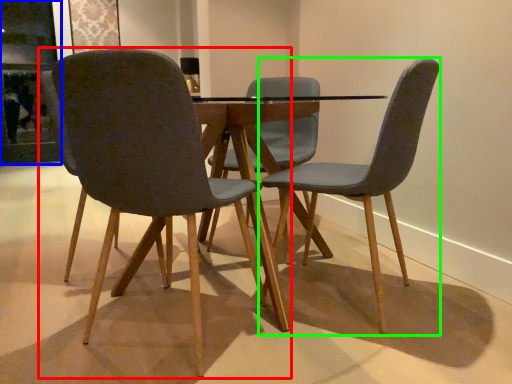
Question: Which is nearer to the chair (highlighted by a red box)? glass door (highlighted by a blue box) or chair (highlighted by a green box).

Choices:
 (A) glass door
 (B) chair

Answer: (B)